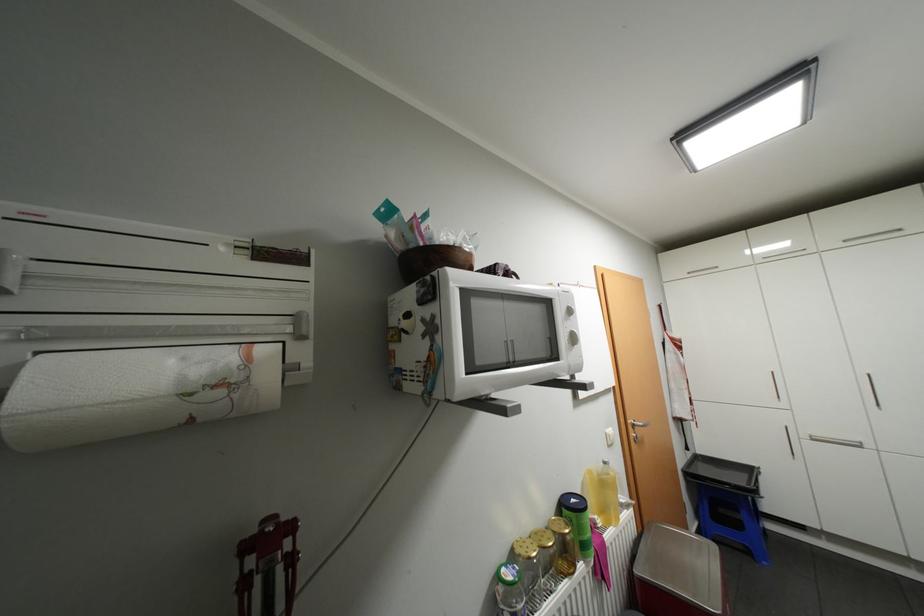
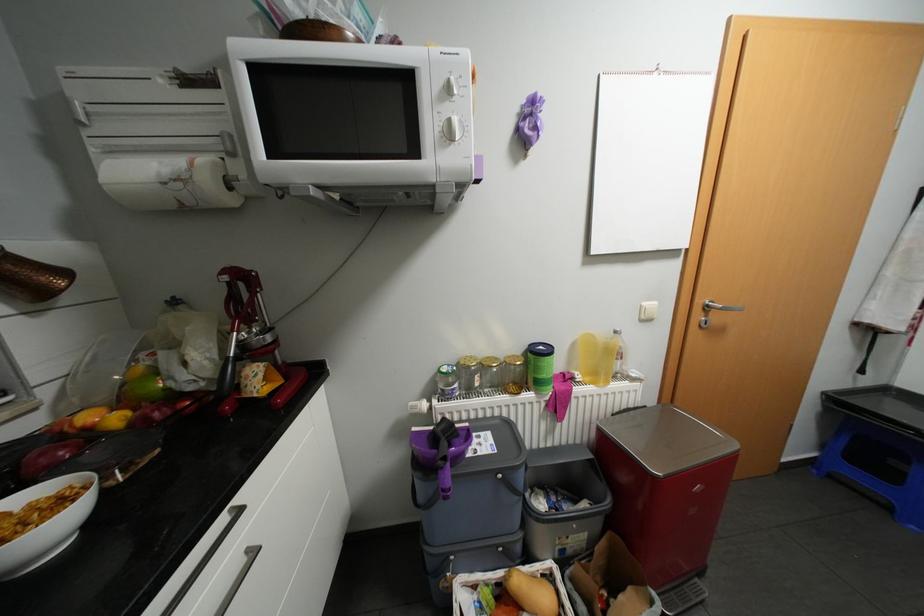
In the second image, find the point that corresponds to [606,521] in the first image.

(587, 377)